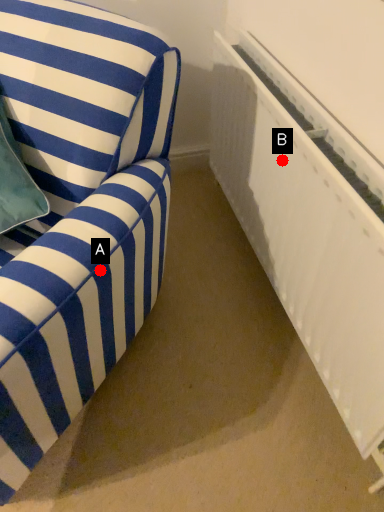
Question: Two points are circled on the image, labeled by A and B beside each circle. Which point is further to the camera?

Choices:
 (A) A is further
 (B) B is further

Answer: (B)